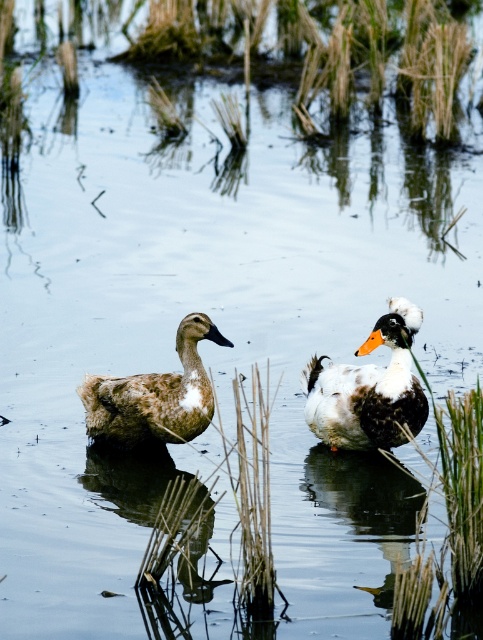
Between brown grass at center and brown fuzzy duck at left, which one is positioned lower?

Positioned lower is brown fuzzy duck at left.

Locate an element on the screen. brown grass at center is located at coordinates (295, 51).

Describe the element at coordinates (295, 51) in the screenshot. I see `brown grass at center` at that location.

Find the location of a particular element. This screenshot has width=483, height=640. brown grass at center is located at coordinates (295, 51).

Who is more distant from viewer, (409, 346) or (219, 344)?

Positioned behind is point (219, 344).

Who is positioned more to the right, white fluffy duck at center or brown fuzzy duck at left?

From the viewer's perspective, white fluffy duck at center appears more on the right side.

Who is more forward, (x=399, y=433) or (x=189, y=396)?

Point (x=189, y=396) is in front.

At what (x,y) coordinates should I click in order to perform the action: click on white fluffy duck at center. Please return your answer as a coordinate pair (x, y). The width and height of the screenshot is (483, 640). Looking at the image, I should click on (369, 388).

Can you confirm if brown grass at center is bigger than white fluffy duck at center?

No, brown grass at center is not bigger than white fluffy duck at center.

Who is more distant from viewer, [256,51] or [366,392]?

Positioned behind is point [256,51].

Does point (344, 3) come closer to viewer compared to point (391, 385)?

No, (344, 3) is behind (391, 385).

At what (x,y) coordinates should I click in order to perform the action: click on brown grass at center. Please return your answer as a coordinate pair (x, y). This screenshot has width=483, height=640. Looking at the image, I should click on (295, 51).